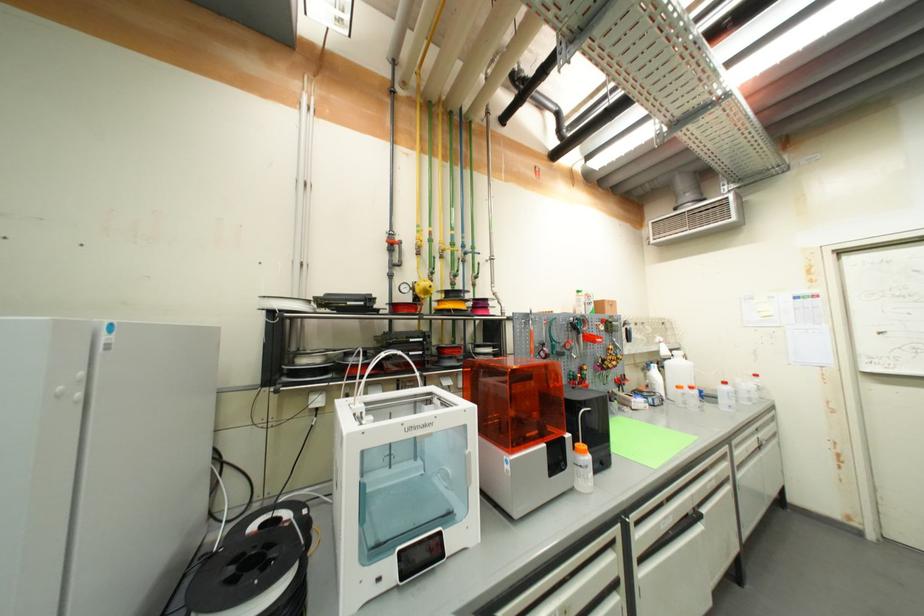
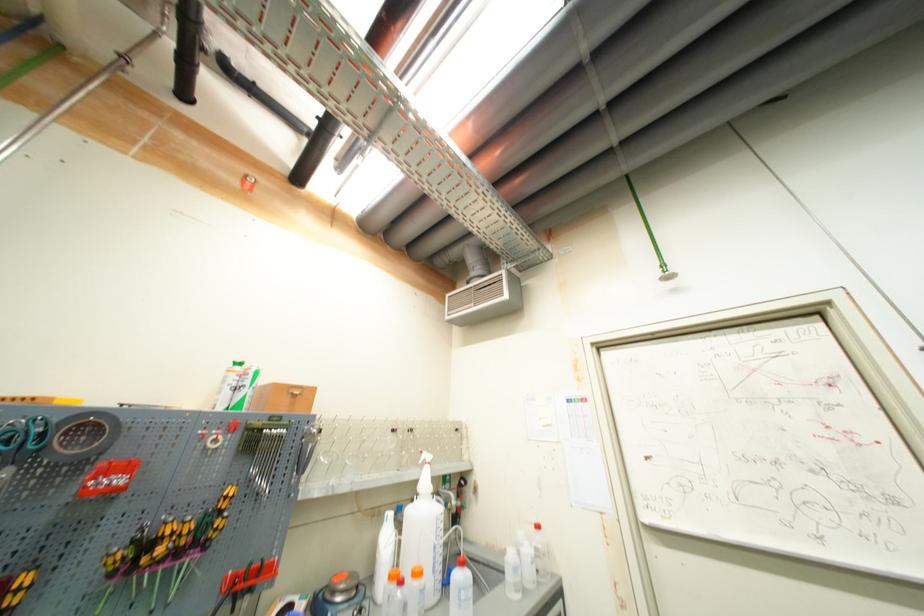
The point at (542,175) is marked in the first image. Where is the corresponding point in the second image?

(253, 185)